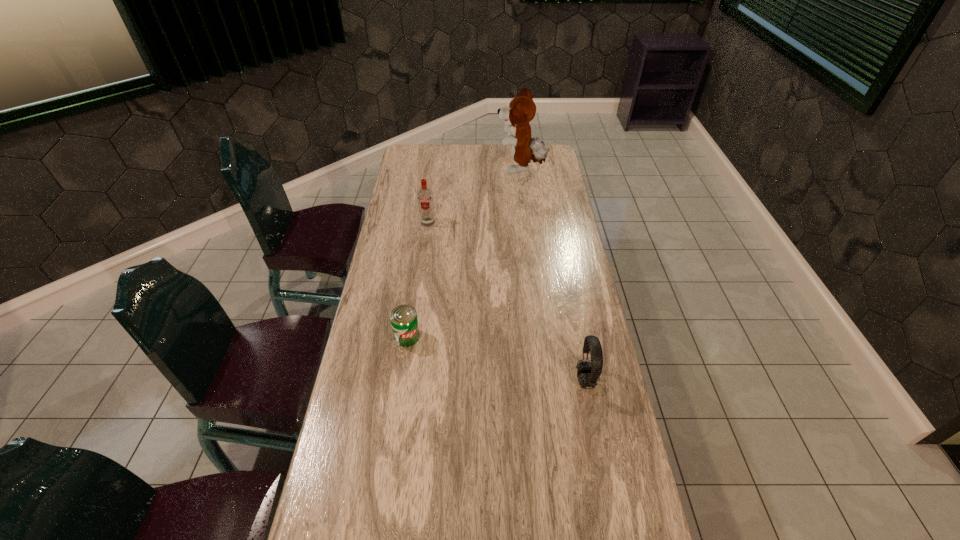
Find the location of a particular element. headset present at the right edge is located at coordinates pos(588,373).

Where is `object located in the far right corner section of the desktop`? This screenshot has height=540, width=960. object located in the far right corner section of the desktop is located at coordinates (521, 110).

In the image, there is a desktop. In order to click on free region at the far edge in this screenshot , I will do `click(460, 153)`.

Locate an element on the screen. Image resolution: width=960 pixels, height=540 pixels. vacant space at the left edge is located at coordinates (398, 301).

In order to click on vacant region at the right edge of the desktop in this screenshot , I will do 568,199.

Image resolution: width=960 pixels, height=540 pixels. I want to click on free space at the far left corner of the desktop, so click(422, 164).

Where is `empty space that is in between the can and the farthest object`? The height and width of the screenshot is (540, 960). empty space that is in between the can and the farthest object is located at coordinates (464, 253).

Where is `free space between the headset and the tallest object`? Image resolution: width=960 pixels, height=540 pixels. free space between the headset and the tallest object is located at coordinates (553, 275).

This screenshot has height=540, width=960. I want to click on free space between the second farthest object and the nearest object, so click(x=507, y=301).

At what (x,y) coordinates should I click in order to perform the action: click on vacant space that's between the vodka and the shortest object. Please return your answer as a coordinate pair (x, y). Looking at the image, I should click on (418, 279).